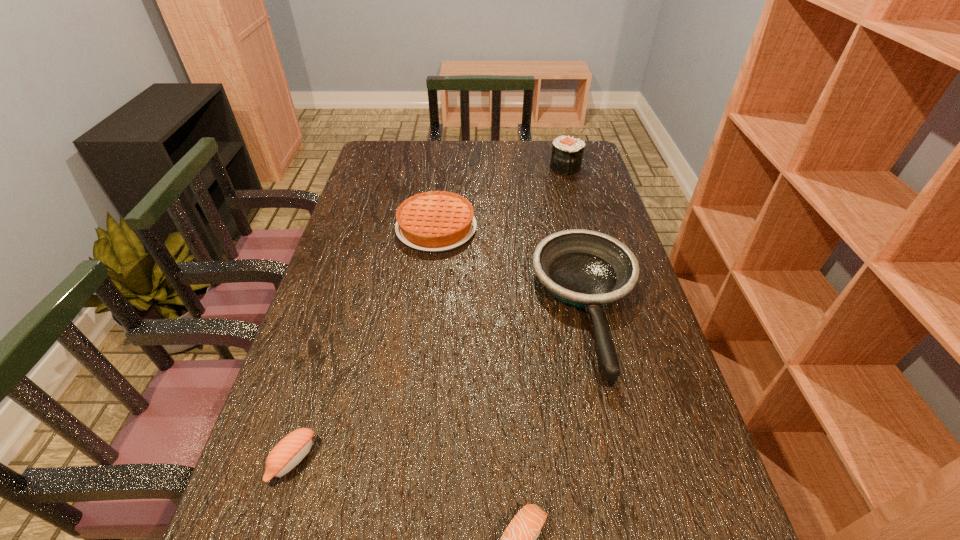
Where is `object that is at the far edge`? object that is at the far edge is located at coordinates (567, 153).

The image size is (960, 540). I want to click on object located in the left edge section of the desktop, so click(289, 452).

You are a GUI agent. You are given a task and a screenshot of the screen. Output one action in this format:
    pyautogui.click(x=<x>, y=<y>)
    Task: Click on the sushi situated at the right edge
    Image resolution: width=960 pixels, height=540 pixels.
    Given the screenshot: What is the action you would take?
    pos(567,153)

Image resolution: width=960 pixels, height=540 pixels. Identify the location of frying pan that is at the right edge. (588, 269).

At what (x,y) coordinates should I click in order to perform the action: click on object that is at the far right corner. Please return your answer as a coordinate pair (x, y). Looking at the image, I should click on (567, 153).

Where is `vacant space at the far edge of the desktop`? This screenshot has height=540, width=960. vacant space at the far edge of the desktop is located at coordinates (516, 160).

I want to click on vacant area at the left edge of the desktop, so click(x=340, y=228).

You are a GUI agent. You are given a task and a screenshot of the screen. Output one action in this format:
    pyautogui.click(x=<x>, y=<y>)
    Task: Click on the blank space at the right edge of the desktop
    This screenshot has width=960, height=540.
    Given the screenshot: What is the action you would take?
    pyautogui.click(x=611, y=230)

The width and height of the screenshot is (960, 540). What are the coordinates of `free space at the far left corner of the desktop` in the screenshot? It's located at (400, 164).

The image size is (960, 540). I want to click on free region at the far right corner, so click(x=583, y=160).